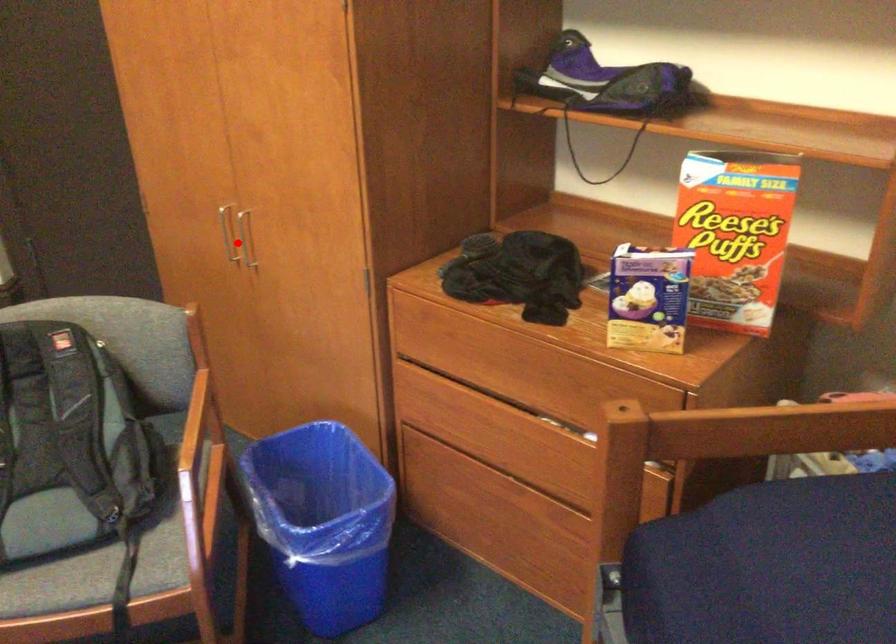
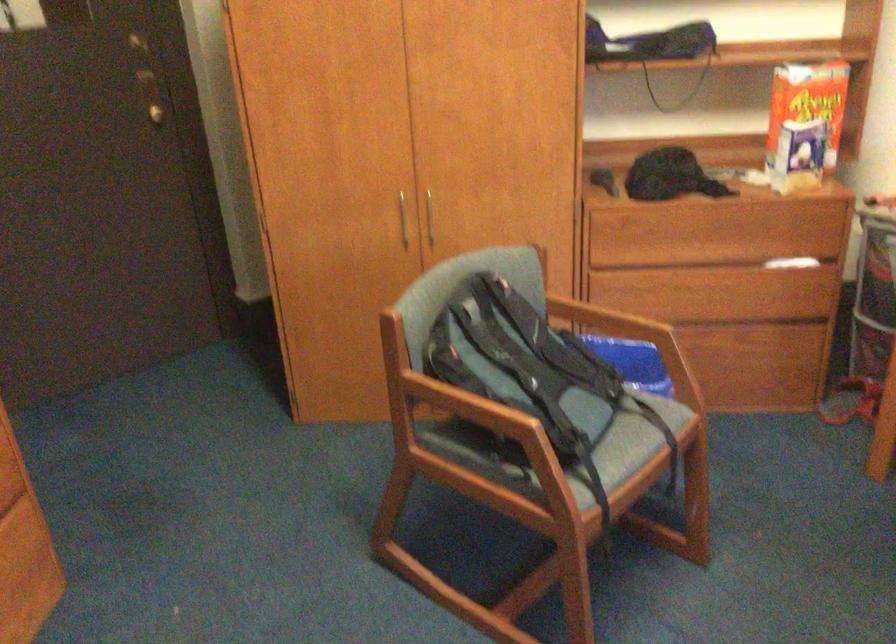
Question: I am providing you with two images of the same scene from different viewpoints. In image1, a red point is highlighted. Considering the same 3D point in image2, which of the following is correct?

Choices:
 (A) It is closer
 (B) It is farther

Answer: (B)